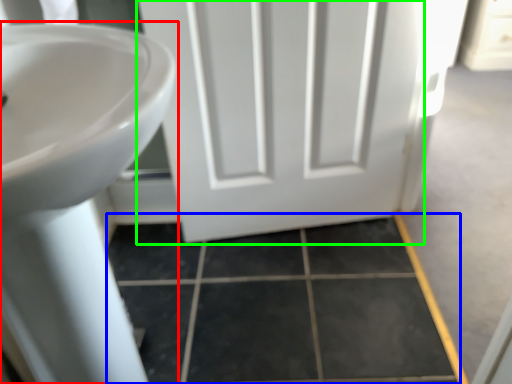
Question: Which object is the closest to the sink (highlighted by a red box)? Choose among these: tile (highlighted by a blue box) or door (highlighted by a green box).

Choices:
 (A) tile
 (B) door

Answer: (A)